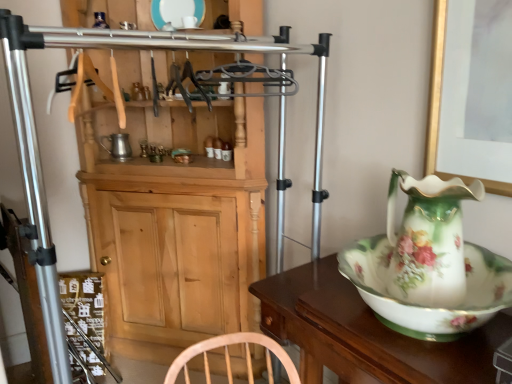
Question: In terms of width, does wooden cabinet at center look wider or thinner when compared to porcelain floral jug at right?

Choices:
 (A) wide
 (B) thin

Answer: (A)

Question: Is wooden cabinet at center situated inside porcelain floral jug at right or outside?

Choices:
 (A) outside
 (B) inside

Answer: (A)

Question: Considering the real-world distances, which object is farthest from the white glossy bowl at right?

Choices:
 (A) wooden cabinet at center
 (B) porcelain floral jug at right
 (C) porcelain plate at upper center

Answer: (C)

Question: Estimate the real-world distances between objects in this image. Which object is farther from the white glossy bowl at right?

Choices:
 (A) wooden cabinet at center
 (B) porcelain floral jug at right
 (C) porcelain plate at upper center

Answer: (C)